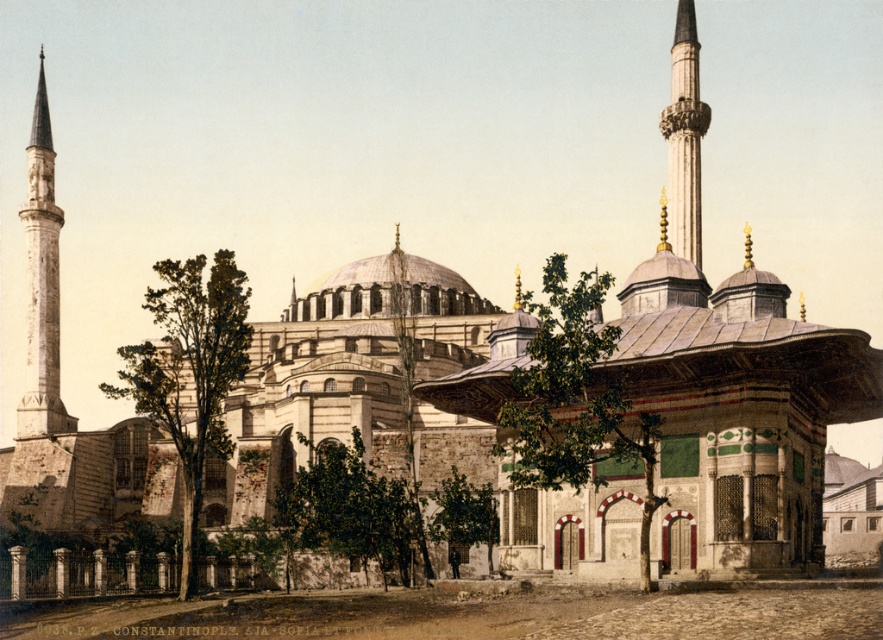
You are standing in front of the grand mosque in Constantinople. You want to take a photo of the white marble minaret at left from where you are standing. Considering the distance, will you need a zoom lens to capture the entire minaret in your photo?

The white marble minaret at left is 136.09 meters away from you. Since this distance is quite far, you would need a zoom lens to ensure the entire minaret is captured in your photo.

You are standing in front of the mosque and notice a specific point marked at coordinates point (42, 282). Based on the scene description, can you identify which structure this point belongs to?

The point (42, 282) is located on the white marble minaret at left.